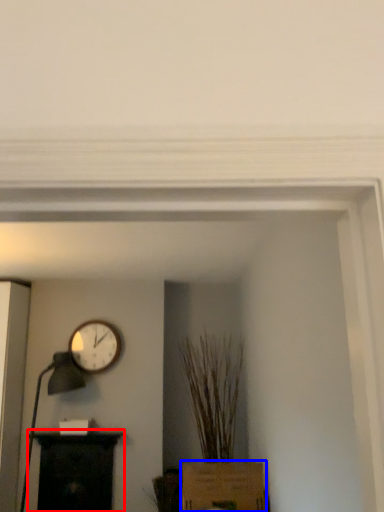
Question: Among these objects, which one is nearest to the camera, furniture (highlighted by a red box) or cardboard box (highlighted by a blue box)?

Choices:
 (A) furniture
 (B) cardboard box

Answer: (B)